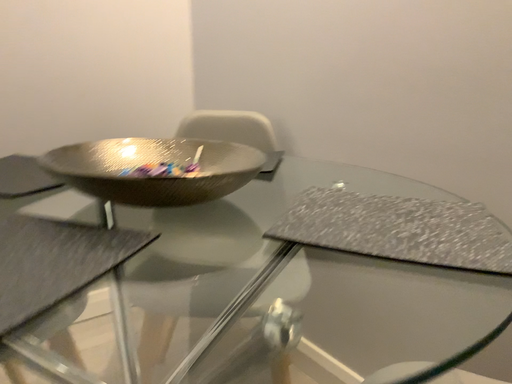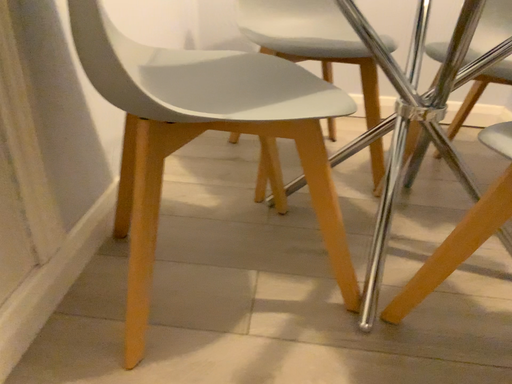
Question: Which way did the camera rotate in the video?

Choices:
 (A) rotated right
 (B) rotated left

Answer: (B)